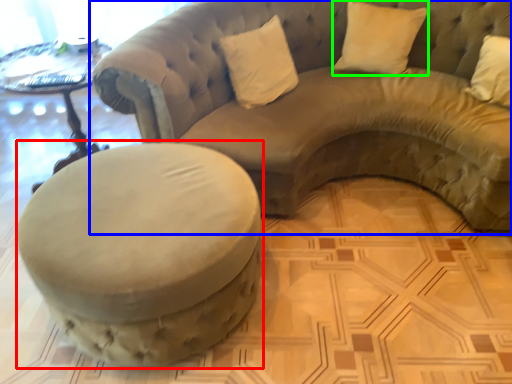
Question: Considering the real-world distances, which object is closest to swivel chair (highlighted by a red box)? studio couch (highlighted by a blue box) or pillow (highlighted by a green box).

Choices:
 (A) studio couch
 (B) pillow

Answer: (A)